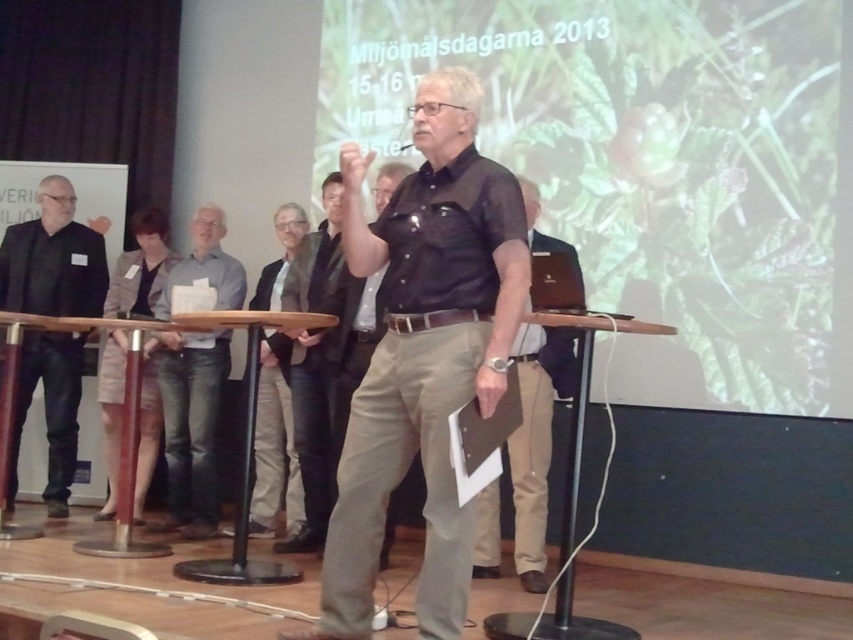
Who is positioned more to the left, green leafy plant at upper center or brown cotton shirt at center?

From the viewer's perspective, brown cotton shirt at center appears more on the left side.

Does green leafy plant at upper center have a lesser width compared to brown cotton shirt at center?

Incorrect, green leafy plant at upper center's width is not less than brown cotton shirt at center's.

Is point (421, 44) positioned before point (450, 410)?

No, it is behind (450, 410).

You are a GUI agent. You are given a task and a screenshot of the screen. Output one action in this format:
    pyautogui.click(x=<x>, y=<y>)
    Task: Click on the green leafy plant at upper center
    The width and height of the screenshot is (853, 640).
    Given the screenshot: What is the action you would take?
    pyautogui.click(x=651, y=168)

Measure the distance between green leafy plant at upper center and camera.

Answer: A distance of 4.19 meters exists between green leafy plant at upper center and camera.

Who is positioned more to the right, green leafy plant at upper center or black leather jacket at left?

green leafy plant at upper center is more to the right.

Does point (570, 221) come behind point (44, 216)?

No.

Identify the location of green leafy plant at upper center. (651, 168).

Is jeans at center smaller than dark brown leather shirt at center?

No, jeans at center is not smaller than dark brown leather shirt at center.

Is jeans at center to the right of dark brown leather shirt at center from the viewer's perspective?

In fact, jeans at center is to the left of dark brown leather shirt at center.

Who is more forward, (212, 214) or (550, 454)?

Point (550, 454) is in front.

Identify the location of jeans at center. The width and height of the screenshot is (853, 640). tap(190, 428).